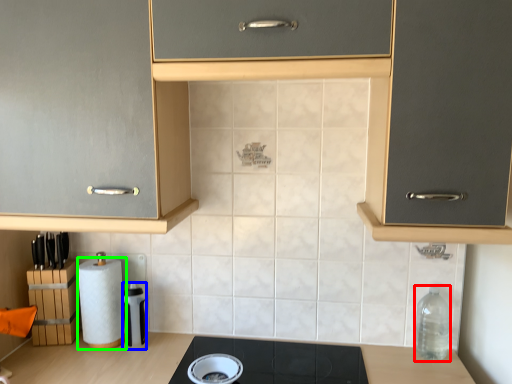
Question: Estimate the real-world distances between objects in this image. Which object is farther from bottle (highlighted by a red box), appliance (highlighted by a blue box) or paper towel (highlighted by a green box)?

Choices:
 (A) appliance
 (B) paper towel

Answer: (B)